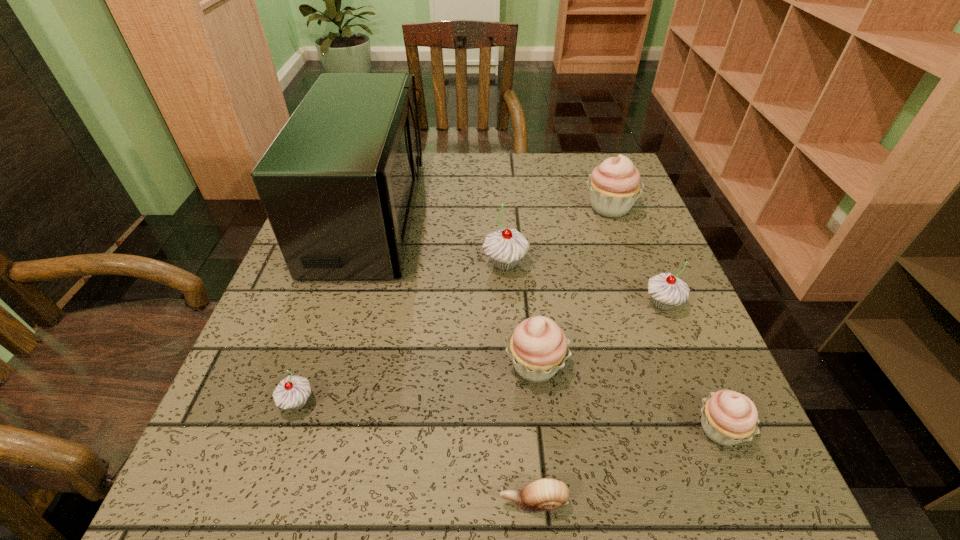
Where is `vacant space that is in between the tallest object and the leftmost pink cupcake`? vacant space that is in between the tallest object and the leftmost pink cupcake is located at coordinates (x=452, y=291).

The height and width of the screenshot is (540, 960). I want to click on free space between the nearest object and the second gray cupcake from right to left, so click(519, 383).

Where is `empty space between the farthest pink cupcake and the tallest object`? This screenshot has width=960, height=540. empty space between the farthest pink cupcake and the tallest object is located at coordinates (490, 212).

Where is `free space between the nearest gray cupcake and the biggest gray cupcake`? This screenshot has height=540, width=960. free space between the nearest gray cupcake and the biggest gray cupcake is located at coordinates (401, 333).

Find the location of a particular element. The width and height of the screenshot is (960, 540). vacant space in between the farthest cupcake and the leftmost gray cupcake is located at coordinates (453, 305).

At what (x,y) coordinates should I click in order to perform the action: click on blank region between the second farthest cupcake and the grey microwave_oven. Please return your answer as a coordinate pair (x, y). The height and width of the screenshot is (540, 960). Looking at the image, I should click on (438, 240).

Identify the location of unoccupied area between the second smallest pink cupcake and the smallest pink cupcake. This screenshot has width=960, height=540. (628, 397).

You are a GUI agent. You are given a task and a screenshot of the screen. Output one action in this format:
    pyautogui.click(x=<x>, y=<y>)
    Task: Click on the free space between the leftmost pink cupcake and the biggest gray cupcake
    This screenshot has height=540, width=960.
    Given the screenshot: What is the action you would take?
    pyautogui.click(x=520, y=315)

Choose which object is the fourth nearest neighbor to the biggest pink cupcake. Please provide its 2D coordinates. Your answer should be formatted as a tuple, i.e. [(x, y)], where the tuple contains the x and y coordinates of a point satisfying the conditions above.

[(338, 184)]

This screenshot has height=540, width=960. I want to click on object that is the second nearest to the second biggest pink cupcake, so click(505, 247).